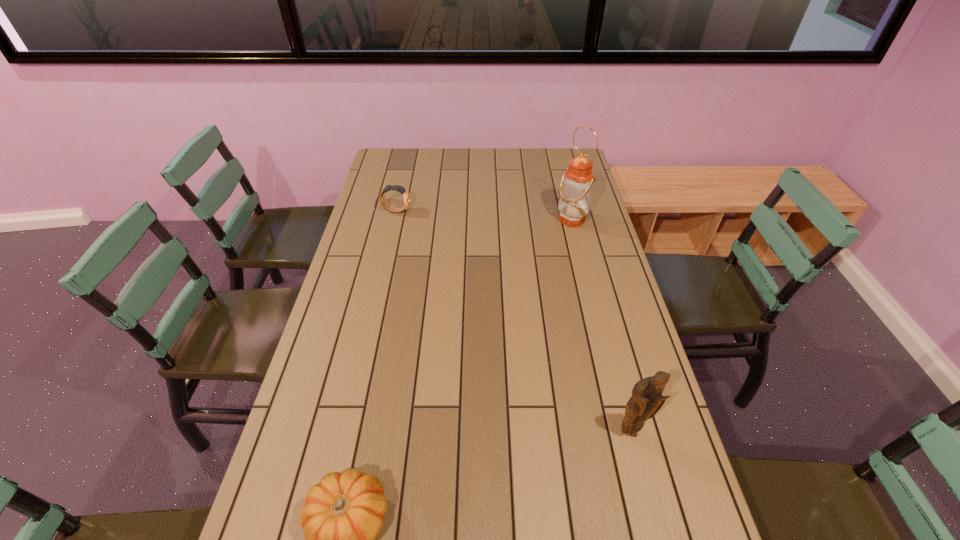
Locate an element on the screen. the tallest object is located at coordinates (576, 187).

Locate an element on the screen. figurine is located at coordinates (646, 400).

Locate an element on the screen. The height and width of the screenshot is (540, 960). the third farthest object is located at coordinates (646, 400).

This screenshot has width=960, height=540. In order to click on watch in this screenshot , I will do `click(402, 190)`.

I want to click on vacant space located on the back of the oil lamp, so click(564, 186).

At what (x,y) coordinates should I click in order to perform the action: click on vacant space located on the front-facing side of the third shortest object. Please return your answer as a coordinate pair (x, y). Looking at the image, I should click on (646, 492).

In order to click on free location located 0.160m on the face of the watch in this screenshot , I will do `click(451, 210)`.

Locate an element on the screen. This screenshot has height=540, width=960. object present at the left edge is located at coordinates (402, 190).

Locate an element on the screen. The height and width of the screenshot is (540, 960). oil lamp present at the right edge is located at coordinates (576, 187).

What are the coordinates of `figurine located at the right edge` in the screenshot? It's located at pyautogui.click(x=646, y=400).